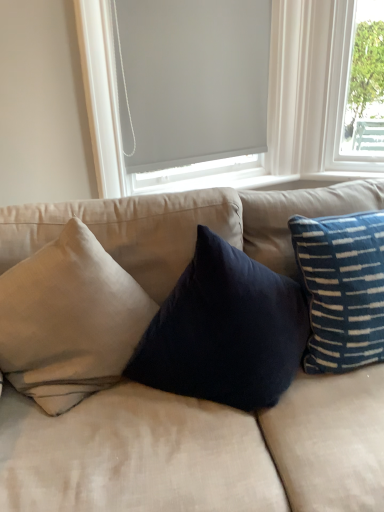
Question: Could you tell me if beige fabric couch at center is turned towards matte gray roller shade at upper center?

Choices:
 (A) no
 (B) yes

Answer: (A)

Question: Is beige fabric couch at center further to camera compared to matte gray roller shade at upper center?

Choices:
 (A) yes
 (B) no

Answer: (B)

Question: From the image's perspective, does beige fabric couch at center appear higher than matte gray roller shade at upper center?

Choices:
 (A) yes
 (B) no

Answer: (B)

Question: Can matte gray roller shade at upper center be found inside beige fabric couch at center?

Choices:
 (A) no
 (B) yes

Answer: (A)

Question: Does beige fabric couch at center have a smaller size compared to matte gray roller shade at upper center?

Choices:
 (A) no
 (B) yes

Answer: (A)

Question: From a real-world perspective, is beige fabric couch at center under matte gray roller shade at upper center?

Choices:
 (A) no
 (B) yes

Answer: (B)

Question: Is blue striped pillow at right, which is the second pillow from left to right, next to beige fabric couch at center?

Choices:
 (A) yes
 (B) no

Answer: (B)

Question: From the image's perspective, would you say blue striped pillow at right, which is the second pillow from left to right, is shown under beige fabric couch at center?

Choices:
 (A) yes
 (B) no

Answer: (B)

Question: Is blue striped pillow at right, which is the second pillow from left to right, oriented towards beige fabric couch at center?

Choices:
 (A) no
 (B) yes

Answer: (B)

Question: Are blue striped pillow at right, which is the second pillow from left to right, and beige fabric couch at center far apart?

Choices:
 (A) yes
 (B) no

Answer: (B)

Question: Does blue striped pillow at right, which is the second pillow from left to right, have a greater width compared to beige fabric couch at center?

Choices:
 (A) no
 (B) yes

Answer: (A)

Question: Does blue striped pillow at right, which is the second pillow from left to right, contain beige fabric couch at center?

Choices:
 (A) no
 (B) yes

Answer: (A)

Question: Does blue striped pillow at right, which is the second pillow from left to right, have a lesser width compared to matte gray roller shade at upper center?

Choices:
 (A) yes
 (B) no

Answer: (B)